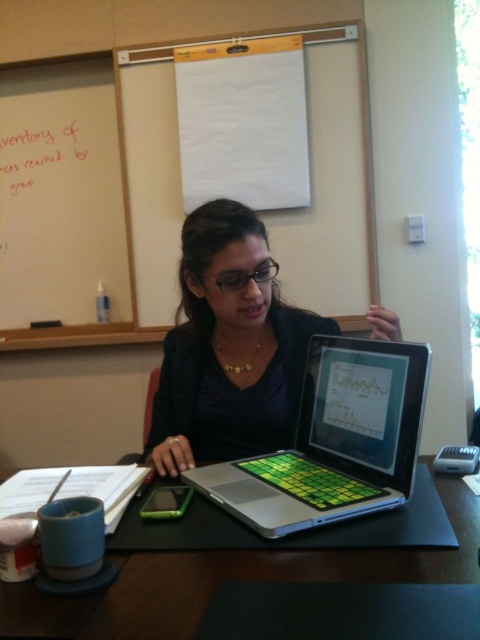
Question: Which point appears closest to the camera in this image?

Choices:
 (A) (203, 269)
 (B) (169, 42)
 (C) (10, 588)
 (D) (283, 476)

Answer: (C)

Question: Does matte black laptop at center have a greater width compared to black matte table at lower center?

Choices:
 (A) yes
 (B) no

Answer: (B)

Question: Which object is positioned farthest from the green matte laptop at center?

Choices:
 (A) matte black laptop at center
 (B) black matte table at lower center

Answer: (A)

Question: Can you confirm if black matte table at lower center is positioned below whiteboard at upper left?

Choices:
 (A) no
 (B) yes

Answer: (B)

Question: Does matte black laptop at center have a larger size compared to whiteboard at upper left?

Choices:
 (A) no
 (B) yes

Answer: (A)

Question: Which point is farther from the camera taking this photo?

Choices:
 (A) (127, 198)
 (B) (374, 387)
 (C) (158, 456)

Answer: (A)